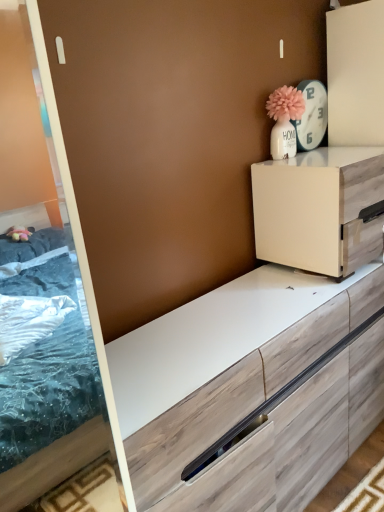
Question: Based on their sizes in the image, would you say white glossy clock at upper right is bigger or smaller than white matte cabinet at upper right?

Choices:
 (A) big
 (B) small

Answer: (B)

Question: Does point (302, 142) appear closer or farther from the camera than point (269, 232)?

Choices:
 (A) farther
 (B) closer

Answer: (A)

Question: In the image, is white glossy clock at upper right positioned in front of or behind white matte cabinet at upper right?

Choices:
 (A) front
 (B) behind

Answer: (B)

Question: Visually, is white matte cabinet at upper right positioned to the left or to the right of white glossy clock at upper right?

Choices:
 (A) right
 (B) left

Answer: (A)

Question: From a real-world perspective, is white matte cabinet at upper right positioned above or below white glossy clock at upper right?

Choices:
 (A) above
 (B) below

Answer: (B)

Question: Would you say white matte cabinet at upper right is inside or outside white glossy clock at upper right?

Choices:
 (A) outside
 (B) inside

Answer: (A)

Question: Considering the positions of point (362, 247) and point (314, 128), is point (362, 247) closer or farther from the camera than point (314, 128)?

Choices:
 (A) farther
 (B) closer

Answer: (B)